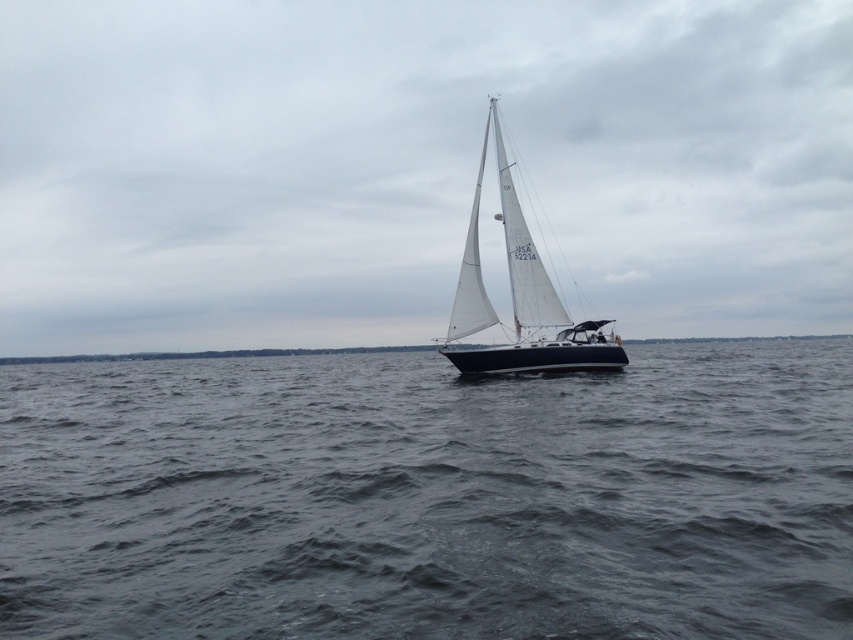
Does dark gray water at center appear on the right side of white matte sailboat at center?

Incorrect, dark gray water at center is not on the right side of white matte sailboat at center.

Who is more distant from viewer, [848,611] or [527,250]?

Positioned behind is point [527,250].

What do you see at coordinates (430, 499) in the screenshot? I see `dark gray water at center` at bounding box center [430, 499].

This screenshot has height=640, width=853. I want to click on dark gray water at center, so click(430, 499).